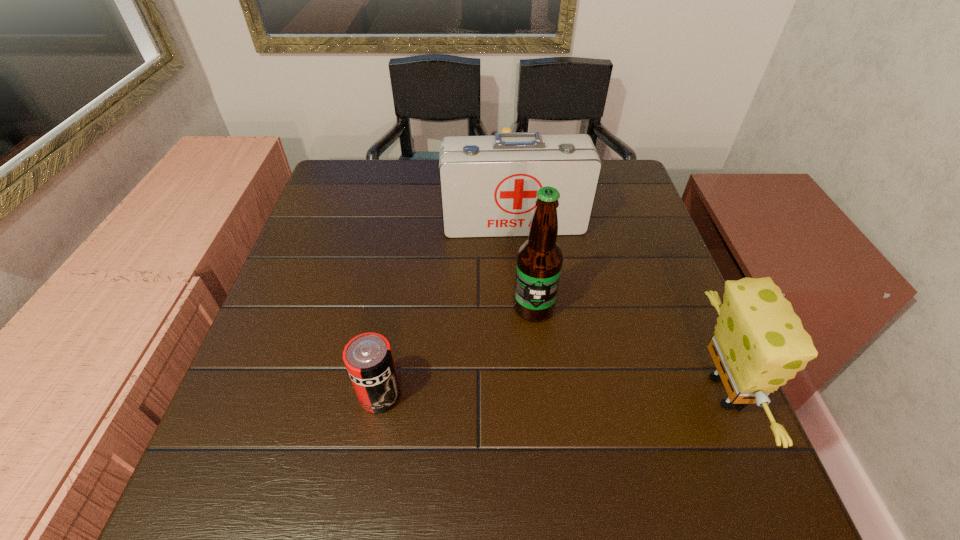
Locate an element on the screen. The height and width of the screenshot is (540, 960). vacant space situated 0.360m on the front-facing side of the fourth nearest object is located at coordinates (535, 354).

Identify the location of free region located on the front-facing side of the fourth nearest object. The width and height of the screenshot is (960, 540). (523, 274).

Find the location of `vacant space situated 0.360m on the face of the farthest object`. vacant space situated 0.360m on the face of the farthest object is located at coordinates (533, 245).

Locate an element on the screen. The width and height of the screenshot is (960, 540). vacant region located 0.300m on the face of the farthest object is located at coordinates (528, 230).

At what (x,y) coordinates should I click in order to perform the action: click on free space located on the face of the farthest object. Please return your answer as a coordinate pair (x, y). This screenshot has height=540, width=960. Looking at the image, I should click on [x=537, y=255].

Locate an element on the screen. The width and height of the screenshot is (960, 540). vacant area situated 0.140m on the label of the beer bottle is located at coordinates (516, 378).

Find the location of `vacant space positioned on the label of the beer bottle`. vacant space positioned on the label of the beer bottle is located at coordinates 517,374.

The image size is (960, 540). I want to click on free space located on the label of the beer bottle, so click(x=503, y=435).

Locate an element on the screen. The width and height of the screenshot is (960, 540). object at the far edge is located at coordinates (505, 130).

What are the coordinates of `can present at the near edge` in the screenshot? It's located at (368, 358).